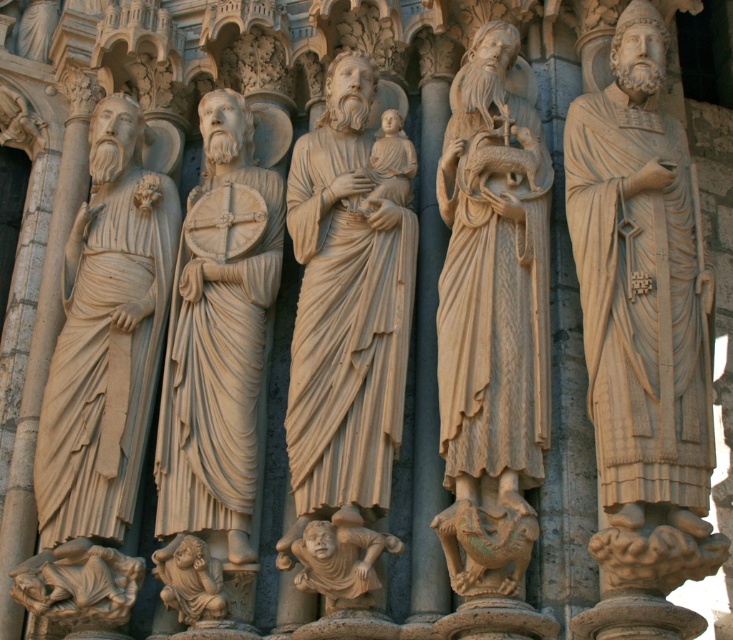
You are an art conservator examining the Gothic facade. You notice the beige stone statue of man holding fish at center and the beige stone cherub at lower center. Which object is closer to the viewer?

Result: The beige stone statue of man holding fish at center is closer to the viewer because it is in front of the beige stone cherub at lower center.

You are standing in front of the Gothic facade and notice two statues. The first is the beige stone statue of man holding fish at center, and the second is the beige stone statue at left. Which statue is positioned further to the left side of the facade?

The beige stone statue at left is positioned further to the left side of the facade compared to the beige stone statue of man holding fish at center.